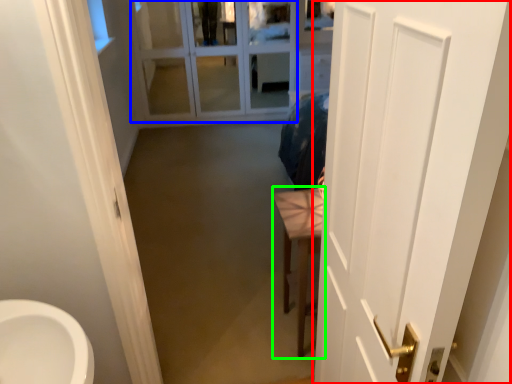
Question: Which object is positioned closest to door (highlighted by a red box)? Select from glass door (highlighted by a blue box) and furniture (highlighted by a green box).

Choices:
 (A) glass door
 (B) furniture

Answer: (B)